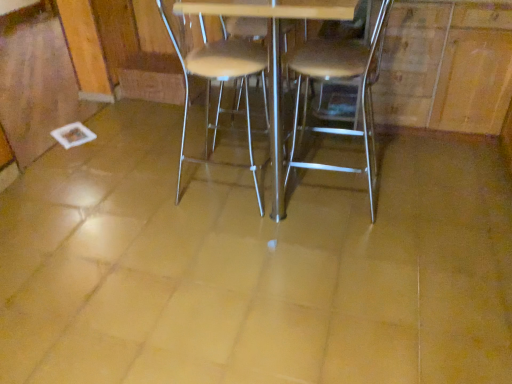
Question: In which direction should I rotate to look at metallic silver chair at center, arranged as the second chair when viewed from the right?

Choices:
 (A) left
 (B) right

Answer: (A)

Question: Are metallic silver chair at center, which appears as the first chair when viewed from the left, and metallic silver table at center far apart?

Choices:
 (A) yes
 (B) no

Answer: (B)

Question: Is metallic silver chair at center, arranged as the second chair when viewed from the right, shorter than metallic silver table at center?

Choices:
 (A) no
 (B) yes

Answer: (B)

Question: Can you confirm if metallic silver chair at center, arranged as the second chair when viewed from the right, is positioned to the left of metallic silver table at center?

Choices:
 (A) yes
 (B) no

Answer: (A)

Question: From a real-world perspective, does metallic silver chair at center, arranged as the second chair when viewed from the right, sit lower than metallic silver table at center?

Choices:
 (A) yes
 (B) no

Answer: (A)

Question: Does metallic silver chair at center, arranged as the second chair when viewed from the right, have a lesser width compared to metallic silver table at center?

Choices:
 (A) yes
 (B) no

Answer: (A)

Question: From the image's perspective, would you say metallic silver chair at center, arranged as the second chair when viewed from the right, is positioned over metallic silver table at center?

Choices:
 (A) no
 (B) yes

Answer: (A)

Question: Could metallic silver chair at center, arranged as the second chair when viewed from the right, be considered to be inside metallic silver chair at center, which appears as the 2th chair when viewed from the left?

Choices:
 (A) no
 (B) yes

Answer: (A)

Question: Does metallic silver chair at center, the first chair positioned from the right, have a greater height compared to metallic silver chair at center, which appears as the first chair when viewed from the left?

Choices:
 (A) no
 (B) yes

Answer: (A)

Question: Is metallic silver chair at center, which appears as the 2th chair when viewed from the left, oriented towards metallic silver chair at center, which appears as the first chair when viewed from the left?

Choices:
 (A) yes
 (B) no

Answer: (A)

Question: Does metallic silver chair at center, the first chair positioned from the right, appear on the left side of metallic silver chair at center, which appears as the first chair when viewed from the left?

Choices:
 (A) yes
 (B) no

Answer: (B)

Question: From a real-world perspective, is metallic silver chair at center, the first chair positioned from the right, beneath metallic silver chair at center, which appears as the first chair when viewed from the left?

Choices:
 (A) yes
 (B) no

Answer: (B)

Question: Can you see metallic silver chair at center, the first chair positioned from the right, touching metallic silver chair at center, arranged as the second chair when viewed from the right?

Choices:
 (A) no
 (B) yes

Answer: (A)

Question: Is metallic silver chair at center, which appears as the first chair when viewed from the left, at the back of metallic silver table at center?

Choices:
 (A) no
 (B) yes

Answer: (A)